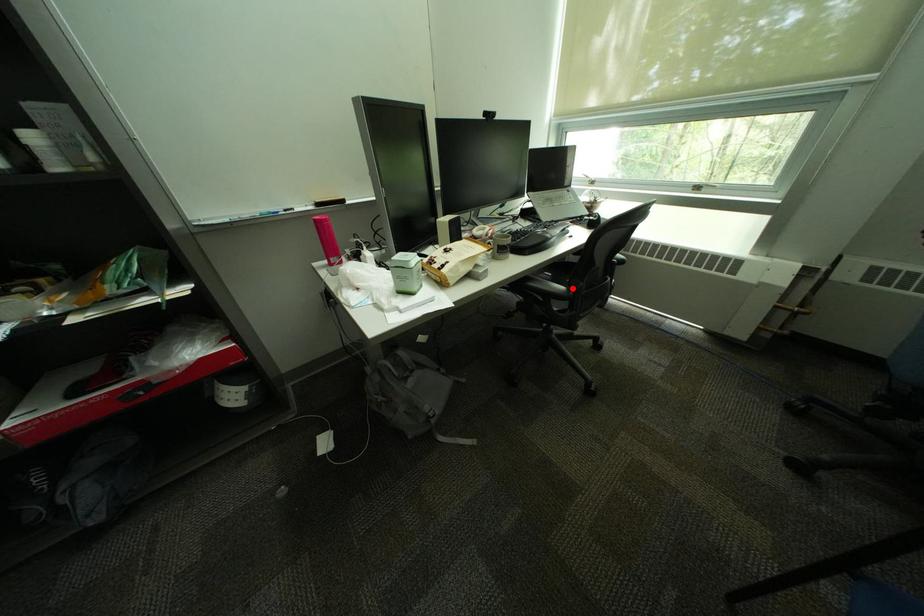
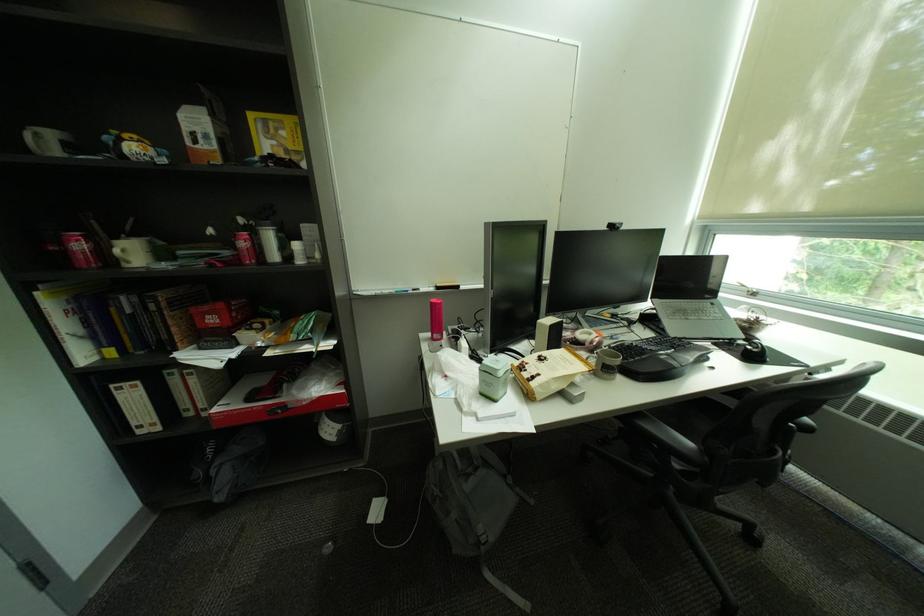
In the second image, find the point that corresponds to the highlighted location in the first image.

(700, 445)